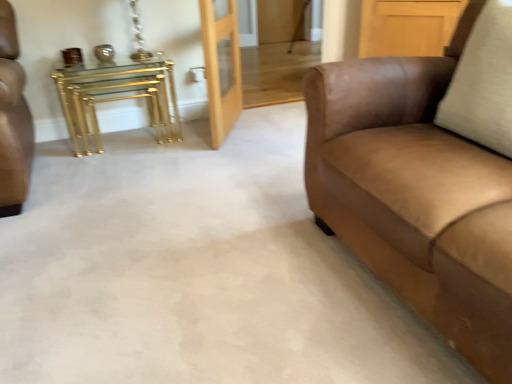
Question: From their relative heights in the image, would you say gold metallic nesting tables at left is taller or shorter than light wood/glass door at center?

Choices:
 (A) tall
 (B) short

Answer: (B)

Question: From a real-world perspective, is gold metallic nesting tables at left physically located above or below light wood/glass door at center?

Choices:
 (A) above
 (B) below

Answer: (B)

Question: Which object is positioned closest to the light wood/glass door at center?

Choices:
 (A) gold metallic nesting tables at left
 (B) suede brown couch at right

Answer: (A)

Question: Which of these objects is positioned closest to the suede brown couch at right?

Choices:
 (A) gold metallic nesting tables at left
 (B) light wood/glass door at center

Answer: (B)